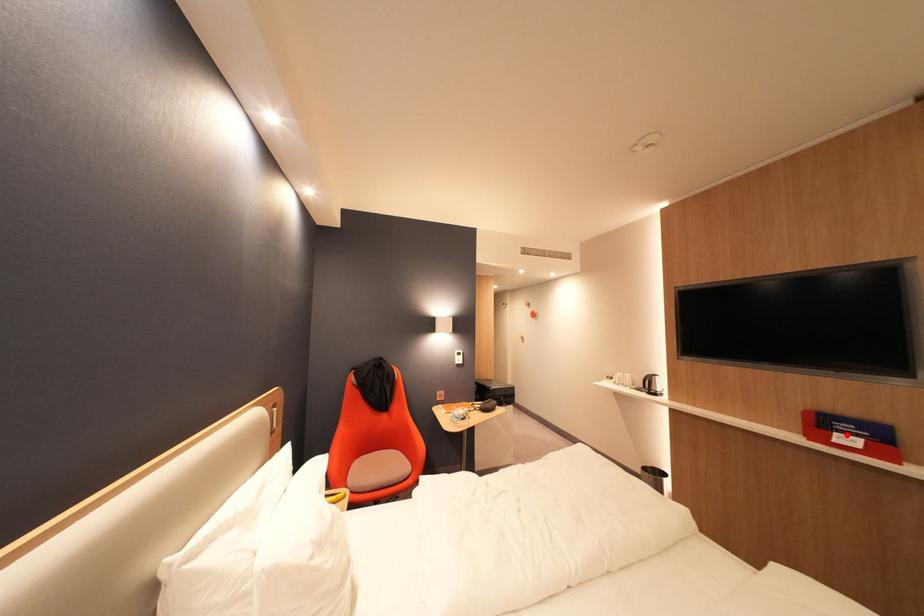
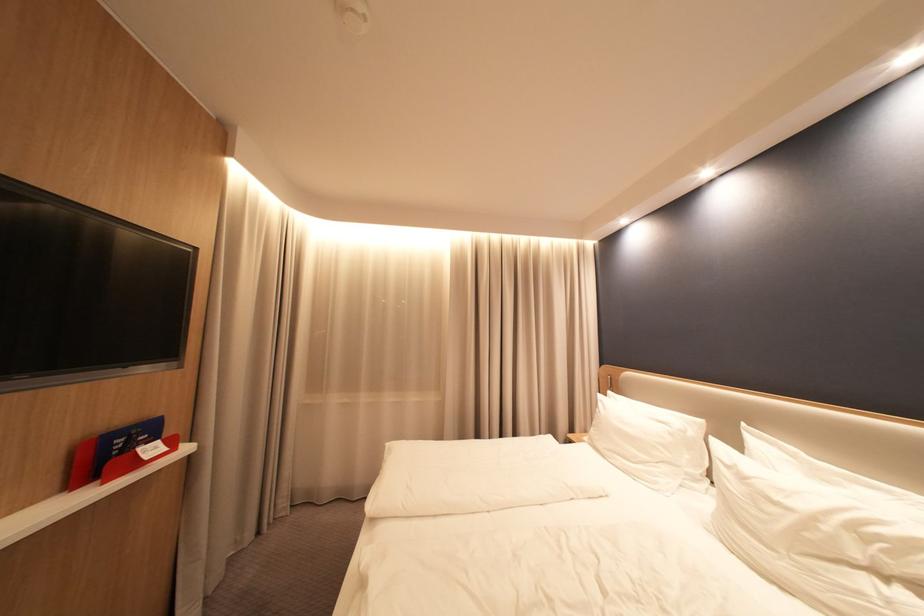
In the second image, find the point that corresponds to the highlighted location in the first image.

(150, 452)